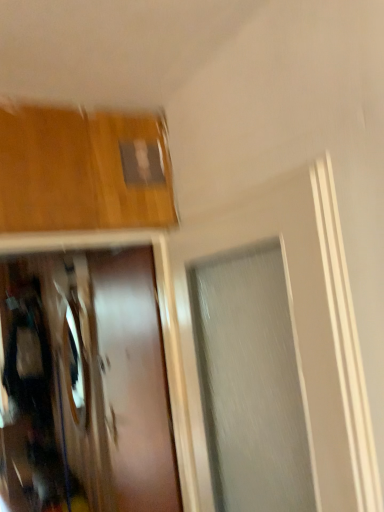
Describe the element at coordinates (75, 367) in the screenshot. I see `shiny silver mirror at left` at that location.

This screenshot has height=512, width=384. Identify the location of shiny silver mirror at left. (75, 367).

The width and height of the screenshot is (384, 512). Describe the element at coordinates (133, 383) in the screenshot. I see `satin brown door at center` at that location.

You are a GUI agent. You are given a task and a screenshot of the screen. Output one action in this format:
    pyautogui.click(x=<x>, y=<y>)
    Task: Click on the satin brown door at center
    
    Given the screenshot: What is the action you would take?
    pyautogui.click(x=133, y=383)

The image size is (384, 512). Identify the location of shiny silver mirror at left. (75, 367).

Considering the positions of objects satin brown door at center and shiny silver mirror at left in the image provided, who is more to the right, satin brown door at center or shiny silver mirror at left?

Positioned to the right is satin brown door at center.

In the image, is satin brown door at center positioned in front of or behind shiny silver mirror at left?

satin brown door at center is in front of shiny silver mirror at left.

Is point (164, 476) farther from camera compared to point (73, 323)?

No, (164, 476) is in front of (73, 323).

From the image's perspective, is satin brown door at center on shiny silver mirror at left?

Yes.

Based on the photo, from a real-world perspective, is satin brown door at center above or below shiny silver mirror at left?

From a real-world perspective, satin brown door at center is physically below shiny silver mirror at left.

Considering the relative sizes of satin brown door at center and shiny silver mirror at left in the image provided, is satin brown door at center wider than shiny silver mirror at left?

Yes, satin brown door at center is wider than shiny silver mirror at left.

Looking at this image, who is shorter, satin brown door at center or shiny silver mirror at left?

shiny silver mirror at left.

Which of these two, satin brown door at center or shiny silver mirror at left, is bigger?

satin brown door at center is bigger.

Is satin brown door at center not inside shiny silver mirror at left?

A: satin brown door at center is positioned outside shiny silver mirror at left.

Is satin brown door at center in contact with shiny silver mirror at left?

No, satin brown door at center is not with shiny silver mirror at left.

Is satin brown door at center oriented towards shiny silver mirror at left?

No, satin brown door at center is not aimed at shiny silver mirror at left.

How different are the orientations of satin brown door at center and shiny silver mirror at left in degrees?

There is a 0.527-degree angle between the facing directions of satin brown door at center and shiny silver mirror at left.

The width and height of the screenshot is (384, 512). I want to click on mirror that is behind the satin brown door at center, so click(75, 367).

Is shiny silver mirror at left to the right of satin brown door at center from the viewer's perspective?

No.

Is shiny silver mirror at left closer to the viewer compared to satin brown door at center?

No, shiny silver mirror at left is behind satin brown door at center.

Does point (85, 429) appear closer or farther from the camera than point (143, 437)?

Point (85, 429) is positioned farther from the camera compared to point (143, 437).

Based on the photo, from the image's perspective, is shiny silver mirror at left beneath satin brown door at center?

Yes, from the image's perspective, shiny silver mirror at left is beneath satin brown door at center.

From a real-world perspective, does shiny silver mirror at left stand above satin brown door at center?

Yes, from a real-world perspective, shiny silver mirror at left is on top of satin brown door at center.

Is shiny silver mirror at left wider than satin brown door at center?

Incorrect, the width of shiny silver mirror at left does not surpass that of satin brown door at center.

Which of these two, shiny silver mirror at left or satin brown door at center, stands shorter?

shiny silver mirror at left.

Is shiny silver mirror at left smaller than satin brown door at center?

Correct, shiny silver mirror at left occupies less space than satin brown door at center.

Is shiny silver mirror at left located outside satin brown door at center?

shiny silver mirror at left is positioned outside satin brown door at center.

Are shiny silver mirror at left and satin brown door at center located far from each other?

They are positioned close to each other.

Looking at this image, is shiny silver mirror at left turned away from satin brown door at center?

shiny silver mirror at left does not have its back to satin brown door at center.

How many degrees apart are the facing directions of shiny silver mirror at left and satin brown door at center?

The angular difference between shiny silver mirror at left and satin brown door at center is 0.527 degrees.

I want to click on door that appears above the shiny silver mirror at left (from the image's perspective), so click(x=133, y=383).

Find the location of `mirror lying below the satin brown door at center (from the image's perspective)`. mirror lying below the satin brown door at center (from the image's perspective) is located at coordinates (75, 367).

In order to click on mirror on the left side of satin brown door at center in this screenshot , I will do `click(75, 367)`.